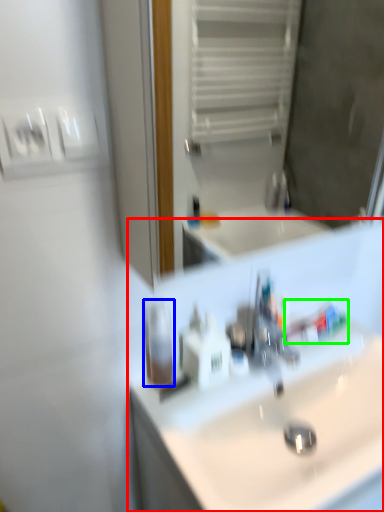
Question: Which object is the closest to the sink (highlighted by a red box)? Choose among these: mouthwash (highlighted by a blue box) or toothpaste (highlighted by a green box).

Choices:
 (A) mouthwash
 (B) toothpaste

Answer: (B)